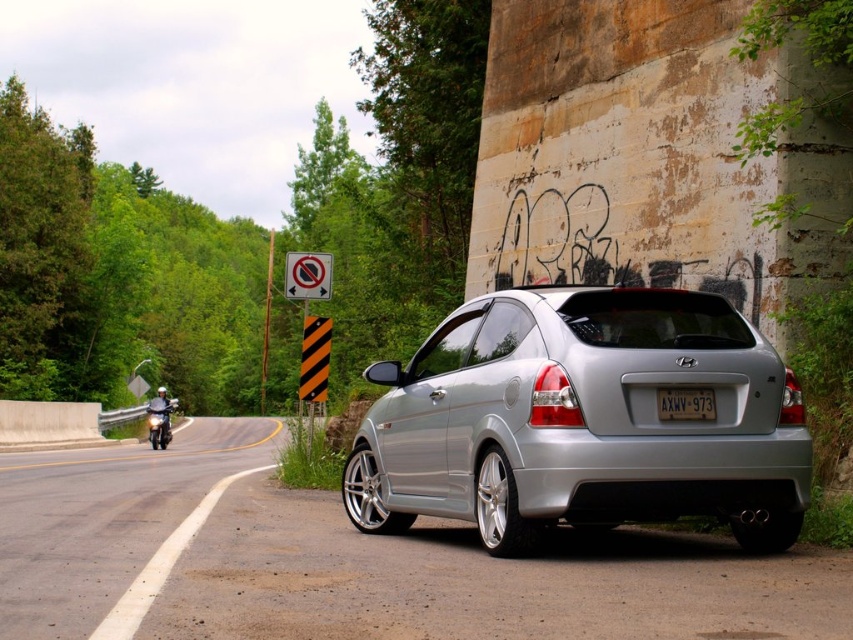
Question: Which point is farther to the camera?

Choices:
 (A) (30, 532)
 (B) (323, 355)

Answer: (B)

Question: Which of the following is the closest to the observer?

Choices:
 (A) (701, 401)
 (B) (167, 419)
 (C) (26, 545)
 (D) (315, 264)

Answer: (A)

Question: Observing the image, what is the correct spatial positioning of black striped traffic sign at upper center in reference to white plastic license plate at center?

Choices:
 (A) right
 (B) left

Answer: (B)

Question: Considering the real-world distances, which object is farthest from the white plastic license plate at center?

Choices:
 (A) brushed metal helmet at left
 (B) white asphalt road at lower left
 (C) black striped traffic sign at upper center
 (D) satin silver hatchback at center

Answer: (A)

Question: Is the position of satin silver hatchback at center less distant than that of brushed metal helmet at left?

Choices:
 (A) yes
 (B) no

Answer: (A)

Question: Can you confirm if satin silver hatchback at center is thinner than black striped traffic sign at upper center?

Choices:
 (A) no
 (B) yes

Answer: (B)